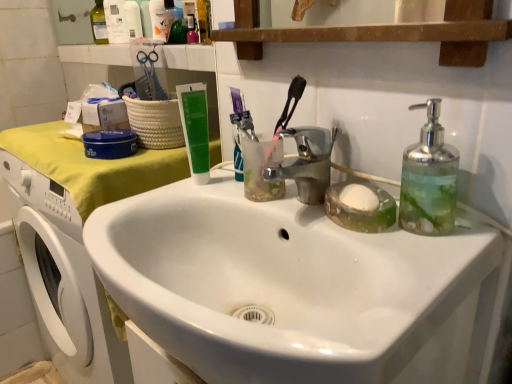
What is the approximate width of clear glass soap dispenser at right?

3.24 inches.

At what (x,y) coordinates should I click in order to perform the action: click on white glossy sink at center. Please return your answer as a coordinate pair (x, y). The width and height of the screenshot is (512, 384). Looking at the image, I should click on (298, 289).

Is clear glass soap dispenser at right wider than green matte tube at upper center?

Correct, the width of clear glass soap dispenser at right exceeds that of green matte tube at upper center.

Can you confirm if clear glass soap dispenser at right is shorter than green matte tube at upper center?

Yes, clear glass soap dispenser at right is shorter than green matte tube at upper center.

Based on their sizes in the image, would you say clear glass soap dispenser at right is bigger or smaller than green matte tube at upper center?

Clearly, clear glass soap dispenser at right is larger in size than green matte tube at upper center.

Find the location of a particular element. This screenshot has height=384, width=512. toothpaste located above the clear glass soap dispenser at right (from the image's perspective) is located at coordinates (195, 129).

Does point (128, 41) appear closer or farther from the camera than point (139, 23)?

Point (128, 41) is positioned farther from the camera compared to point (139, 23).

From a real-world perspective, between translucent plastic bottle at upper left, placed as the third toiletry when sorted from right to left, and white plastic bottle at upper left, the second toiletry viewed from the left, who is vertically lower?

white plastic bottle at upper left, the second toiletry viewed from the left, from a real-world perspective.

Is translucent plastic bottle at upper left, the 1th toiletry when ordered from left to right, shorter than white plastic bottle at upper left, acting as the 2th toiletry starting from the front?

No, translucent plastic bottle at upper left, the 1th toiletry when ordered from left to right, is not shorter than white plastic bottle at upper left, acting as the 2th toiletry starting from the front.

You are a GUI agent. You are given a task and a screenshot of the screen. Output one action in this format:
    pyautogui.click(x=<x>, y=<y>)
    Task: Click on the tap behind the clear glass soap dispenser at right
    This screenshot has height=384, width=512.
    Given the screenshot: What is the action you would take?
    pyautogui.click(x=308, y=162)

Considering the positions of objects clear glass soap dispenser at right and chrome metallic faucet at center in the image provided, who is behind, clear glass soap dispenser at right or chrome metallic faucet at center?

chrome metallic faucet at center is more distant.

Looking at this image, considering the sizes of clear glass soap dispenser at right and chrome metallic faucet at center in the image, is clear glass soap dispenser at right wider or thinner than chrome metallic faucet at center?

Considering their sizes, clear glass soap dispenser at right looks slimmer than chrome metallic faucet at center.

Is clear glass soap dispenser at right aimed at chrome metallic faucet at center?

No.

Is white plastic bottle at upper left, the second toiletry viewed from the left, positioned with its back to white glossy sink at center?

That's not correct — white plastic bottle at upper left, the second toiletry viewed from the left, is not looking away from white glossy sink at center.

Consider the image. Is white plastic bottle at upper left, the second toiletry in the right-to-left sequence, inside or outside of white glossy sink at center?

white plastic bottle at upper left, the second toiletry in the right-to-left sequence, is located beyond the bounds of white glossy sink at center.

From the image's perspective, which object appears higher, white plastic bottle at upper left, the second toiletry in the right-to-left sequence, or white glossy sink at center?

white plastic bottle at upper left, the second toiletry in the right-to-left sequence, is shown above in the image.

Is white plastic bottle at upper left, acting as the 2th toiletry starting from the front, next to white glossy sink at center and touching it?

No, white plastic bottle at upper left, acting as the 2th toiletry starting from the front, is not touching white glossy sink at center.

Is the position of translucent plastic bottle at upper center, the 3th toiletry positioned from the left, less distant than that of white plastic bottle at upper left, the second toiletry from the back?

Yes, it is in front of white plastic bottle at upper left, the second toiletry from the back.

Is translucent plastic bottle at upper center, the 3th toiletry when ordered from back to front, facing towards white plastic bottle at upper left, the second toiletry from the back?

No, translucent plastic bottle at upper center, the 3th toiletry when ordered from back to front, does not turn towards white plastic bottle at upper left, the second toiletry from the back.

From the image's perspective, who appears lower, translucent plastic bottle at upper center, the 3th toiletry when ordered from back to front, or white plastic bottle at upper left, acting as the 2th toiletry starting from the front?

translucent plastic bottle at upper center, the 3th toiletry when ordered from back to front, from the image's perspective.

Between translucent plastic bottle at upper center, the 3th toiletry when ordered from back to front, and white plastic bottle at upper left, the second toiletry from the back, which one appears on the right side from the viewer's perspective?

From the viewer's perspective, translucent plastic bottle at upper center, the 3th toiletry when ordered from back to front, appears more on the right side.

Considering the sizes of green matte tube at upper center and chrome metallic faucet at center in the image, is green matte tube at upper center taller or shorter than chrome metallic faucet at center?

green matte tube at upper center is taller than chrome metallic faucet at center.

Is chrome metallic faucet at center inside green matte tube at upper center?

No, chrome metallic faucet at center is not inside green matte tube at upper center.

Considering the relative sizes of green matte tube at upper center and chrome metallic faucet at center in the image provided, is green matte tube at upper center smaller than chrome metallic faucet at center?

Yes.

Considering the sizes of white plastic bottle at upper left, the second toiletry from the back, and translucent plastic bottle at upper left, the first toiletry positioned from the back, in the image, is white plastic bottle at upper left, the second toiletry from the back, taller or shorter than translucent plastic bottle at upper left, the first toiletry positioned from the back,?

Clearly, white plastic bottle at upper left, the second toiletry from the back, is shorter compared to translucent plastic bottle at upper left, the first toiletry positioned from the back.

Is white plastic bottle at upper left, the second toiletry in the right-to-left sequence, in front of translucent plastic bottle at upper left, placed as the third toiletry when sorted from right to left?

Yes, white plastic bottle at upper left, the second toiletry in the right-to-left sequence, is closer to the camera.

Is white plastic bottle at upper left, the second toiletry viewed from the left, oriented away from translucent plastic bottle at upper left, the 1th toiletry when ordered from left to right?

No, white plastic bottle at upper left, the second toiletry viewed from the left, is not facing the opposite direction of translucent plastic bottle at upper left, the 1th toiletry when ordered from left to right.

Considering the sizes of objects white plastic bottle at upper left, acting as the 2th toiletry starting from the front, and translucent plastic bottle at upper left, the 1th toiletry when ordered from left to right, in the image provided, who is thinner, white plastic bottle at upper left, acting as the 2th toiletry starting from the front, or translucent plastic bottle at upper left, the 1th toiletry when ordered from left to right,?

white plastic bottle at upper left, acting as the 2th toiletry starting from the front, is thinner.

Find the location of `soap dispenser below the green matte tube at upper center (from the image's perspective)`. soap dispenser below the green matte tube at upper center (from the image's perspective) is located at coordinates (429, 179).

Where is `the 1st toiletry directly beneath the translucent plastic bottle at upper left, the first toiletry positioned from the back (from a real-world perspective)`? Image resolution: width=512 pixels, height=384 pixels. the 1st toiletry directly beneath the translucent plastic bottle at upper left, the first toiletry positioned from the back (from a real-world perspective) is located at coordinates (132, 20).

Considering their positions, is green matte tube at upper center positioned closer to translucent plastic bottle at upper center, the 3th toiletry positioned from the left, than white glossy sink at center?

green matte tube at upper center is positioned closer to the anchor translucent plastic bottle at upper center, the 3th toiletry positioned from the left.

Which object lies nearer to the anchor point white plastic bottle at upper left, acting as the 2th toiletry starting from the front, translucent plastic bottle at upper left, which appears as the third toiletry when viewed from the front, or translucent plastic bottle at upper center, the 3th toiletry positioned from the left?

Among the two, translucent plastic bottle at upper left, which appears as the third toiletry when viewed from the front, is located nearer to white plastic bottle at upper left, acting as the 2th toiletry starting from the front.

Estimate the real-world distances between objects in this image. Which object is closer to clear glass soap dispenser at right, translucent plastic bottle at upper left, the first toiletry positioned from the back, or chrome metallic faucet at center?

Based on the image, chrome metallic faucet at center appears to be nearer to clear glass soap dispenser at right.

Looking at this image, considering their positions, is translucent plastic bottle at upper center, the 3th toiletry when ordered from back to front, positioned further to translucent plastic bottle at upper left, the first toiletry positioned from the back, than white glossy sink at center?

white glossy sink at center lies further to translucent plastic bottle at upper left, the first toiletry positioned from the back, than the other object.

Based on their spatial positions, is translucent plastic bottle at upper center, which is counted as the 1th toiletry, starting from the front, or green matte tube at upper center closer to white glossy sink at center?

green matte tube at upper center.

Looking at the image, which one is located further to translucent plastic bottle at upper center, which is counted as the 1th toiletry, starting from the front, white plastic bottle at upper left, the second toiletry from the back, or translucent plastic bottle at upper left, placed as the third toiletry when sorted from right to left?

Among the two, translucent plastic bottle at upper left, placed as the third toiletry when sorted from right to left, is located further to translucent plastic bottle at upper center, which is counted as the 1th toiletry, starting from the front.

From the image, which object appears to be nearer to white plastic bottle at upper left, the second toiletry from the back, chrome metallic faucet at center or green matte tube at upper center?

green matte tube at upper center is positioned closer to the anchor white plastic bottle at upper left, the second toiletry from the back.

From the image, which object appears to be farther from green matte tube at upper center, translucent plastic bottle at upper center, the 3th toiletry positioned from the left, or white plastic bottle at upper left, the second toiletry from the back?

white plastic bottle at upper left, the second toiletry from the back, is positioned further to the anchor green matte tube at upper center.

You are a GUI agent. You are given a task and a screenshot of the screen. Output one action in this format:
    pyautogui.click(x=<x>, y=<y>)
    Task: Click on the soap dispenser positioned between white glossy sink at center and green matte tube at upper center from near to far
    The width and height of the screenshot is (512, 384).
    Given the screenshot: What is the action you would take?
    pyautogui.click(x=429, y=179)

Find the location of a particular element. soap dispenser between white glossy sink at center and chrome metallic faucet at center along the z-axis is located at coordinates (429, 179).

You are a GUI agent. You are given a task and a screenshot of the screen. Output one action in this format:
    pyautogui.click(x=<x>, y=<y>)
    Task: Click on the toiletry located between translucent plastic bottle at upper center, the 3th toiletry positioned from the left, and translucent plastic bottle at upper left, the first toiletry positioned from the back, in the depth direction
    This screenshot has width=512, height=384.
    Given the screenshot: What is the action you would take?
    pyautogui.click(x=132, y=20)

You are a GUI agent. You are given a task and a screenshot of the screen. Output one action in this format:
    pyautogui.click(x=<x>, y=<y>)
    Task: Click on the toothpaste between white glossy sink at center and translucent plastic bottle at upper center, the 3th toiletry positioned from the left, along the z-axis
    
    Given the screenshot: What is the action you would take?
    pyautogui.click(x=195, y=129)